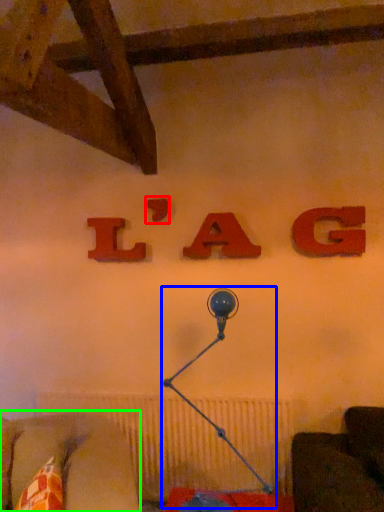
Question: Considering the real-world distances, which object is closest to alphabet (highlighted by a red box)? table lamp (highlighted by a blue box) or furniture (highlighted by a green box).

Choices:
 (A) table lamp
 (B) furniture

Answer: (A)